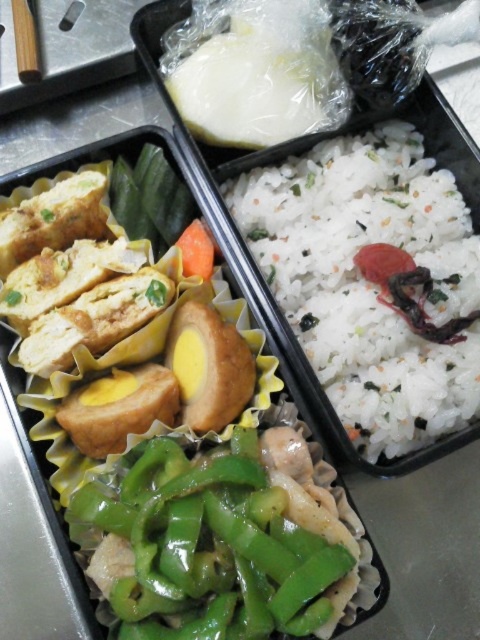
You are preparing to take a photo of the bento box for a food blog. You want to highlight both the white matte rice at center and the green glossy bell pepper at center. Which object should you focus on if you want to capture the wider one in the frame?

The white matte rice at center is wider than the green glossy bell pepper at center, so you should focus on the white matte rice at center to capture the wider object in the frame.

You are a food delivery robot trying to navigate the bento box compartments. You need to move from the top compartment to the right compartment. There are two points marked as obstacles. The first obstacle is at point (407, 433) and the second is at point (122, 557). Since you can only move around obstacles that are in front of you, which obstacle should you avoid first?

You should avoid point (122, 557) first because point (407, 433) is behind point (122, 557), so the first obstacle you encounter on your path would be point (122, 557).

You are a food critic inspecting a bento box. You notice the white matte rice at center and the green glossy bell pepper at center. Which of these two items is located to the right of the other?

The white matte rice at center is positioned on the right side of green glossy bell pepper at center.